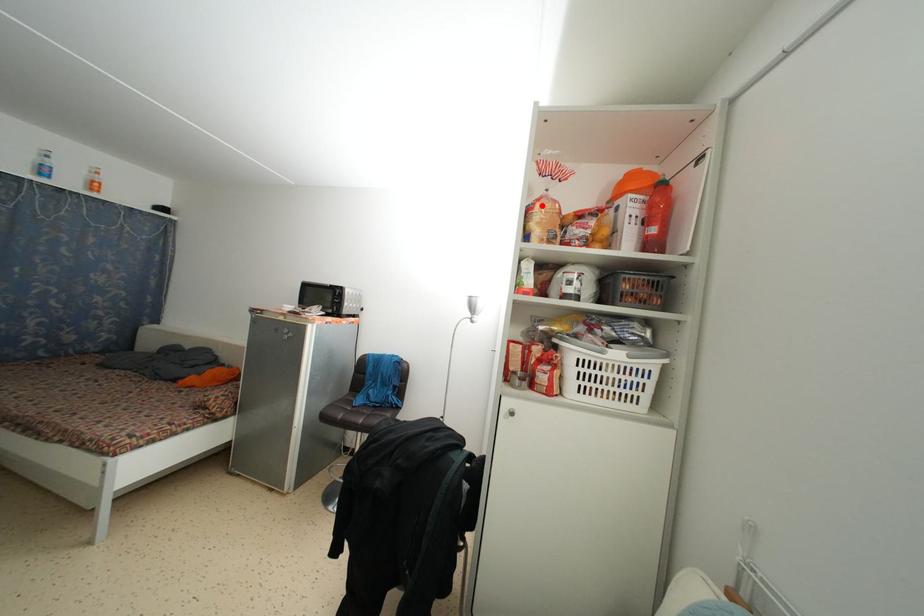
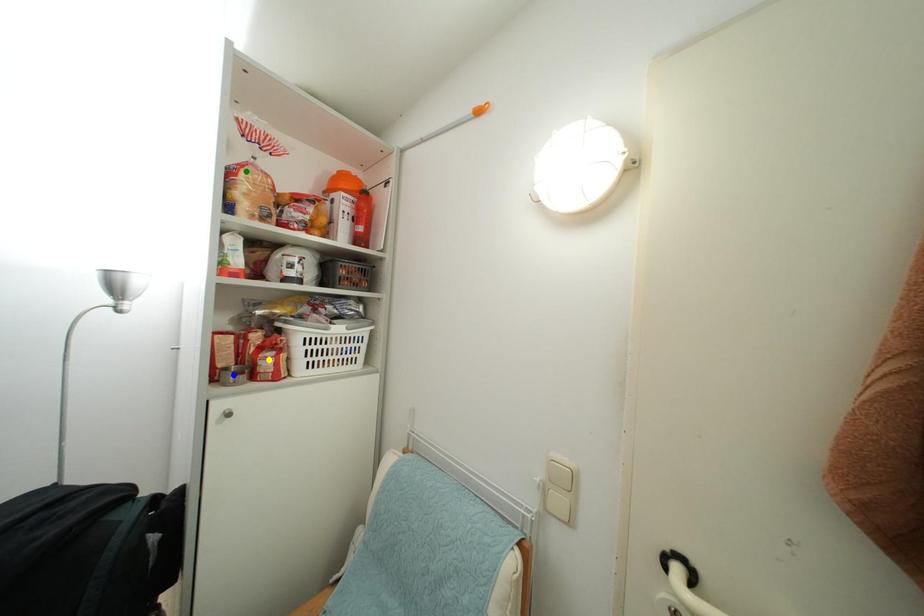
Question: I am providing you with two images of the same scene from different viewpoints. A red point is marked on the first image. You are given multiple points on the second image. Which point in image 2 is actually the same real-world point as the red point in image 1?

Choices:
 (A) yellow point
 (B) green point
 (C) blue point

Answer: (B)